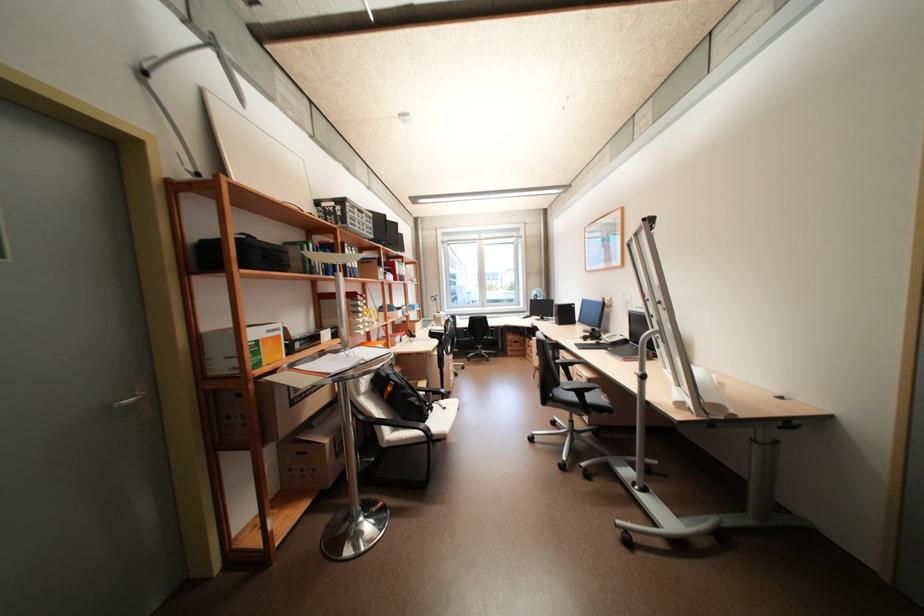
Where is `white door handle`? The width and height of the screenshot is (924, 616). white door handle is located at coordinates (132, 399).